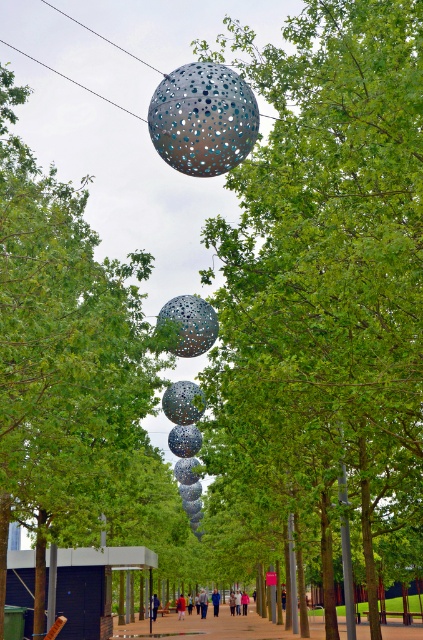
You are standing at the entrance of the pathway and want to reach the perforated metallic sphere at center. According to the coordinates provided, in which direction should you walk to reach it?

The perforated metallic sphere at center is located at coordinates point (191, 323), which means it is positioned centrally in the scene. Since you are at the entrance, you should walk straight ahead along the pathway to reach it.

You are a photographer standing on the pathway and see two people wearing jackets. One has a blue fabric jacket at center and the other has a red fabric jacket at center. Which jacket is more to the left?

The blue fabric jacket at center is positioned on the left side of the red fabric jacket at center, so the blue fabric jacket at center is more to the left.

You are standing at the starting point of the pathway and want to reach a destination located at point (205, 596). There is an obstacle at point (151, 600). Will you need to go around the obstacle to reach your destination?

Point (151, 600) is in front of point (205, 596), so you will need to go around the obstacle at point (151, 600) to reach your destination at point (205, 596).